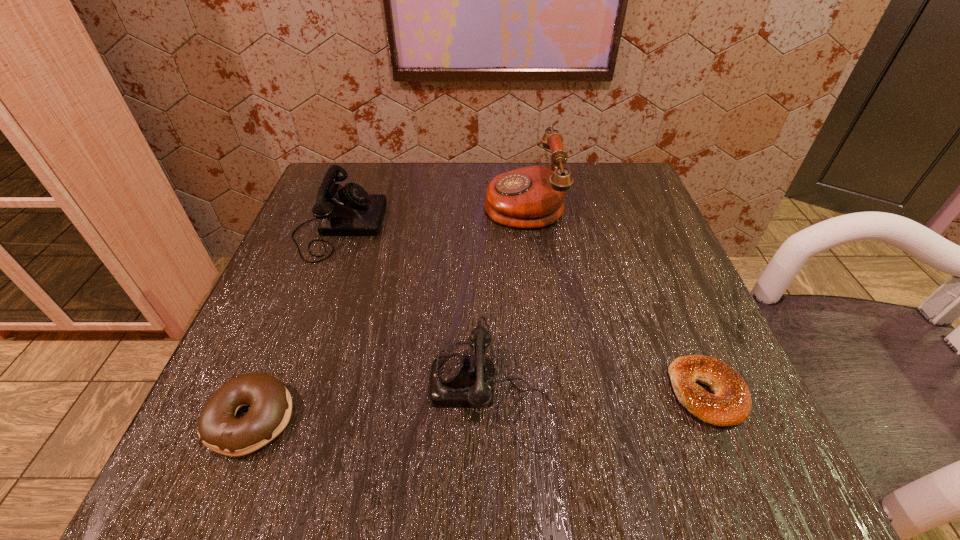
The image size is (960, 540). I want to click on vacant region located on the dial of the tallest object, so click(x=321, y=201).

Locate an element on the screen. This screenshot has height=540, width=960. free space located on the front face of the second shortest telephone is located at coordinates (435, 226).

I want to click on vacant region located on the front-facing side of the shortest telephone, so click(x=319, y=387).

Locate an element on the screen. vacant space located 0.120m on the front-facing side of the shortest telephone is located at coordinates (347, 387).

The height and width of the screenshot is (540, 960). Find the location of `vacant position located 0.160m on the front-facing side of the shortest telephone`. vacant position located 0.160m on the front-facing side of the shortest telephone is located at coordinates (319, 387).

Where is `free space located 0.280m on the back of the rightmost object`? This screenshot has height=540, width=960. free space located 0.280m on the back of the rightmost object is located at coordinates (645, 243).

This screenshot has width=960, height=540. Find the location of `telephone present at the near edge`. telephone present at the near edge is located at coordinates (455, 381).

This screenshot has height=540, width=960. I want to click on doughnut at the near edge, so click(x=270, y=402).

Locate an element on the screen. This screenshot has width=960, height=540. bagel that is positioned at the near edge is located at coordinates 731,404.

You are a GUI agent. You are given a task and a screenshot of the screen. Output one action in this format:
    pyautogui.click(x=<x>, y=<y>)
    Task: Click on the telephone that is at the left edge
    The width and height of the screenshot is (960, 540).
    Given the screenshot: What is the action you would take?
    pyautogui.click(x=349, y=210)